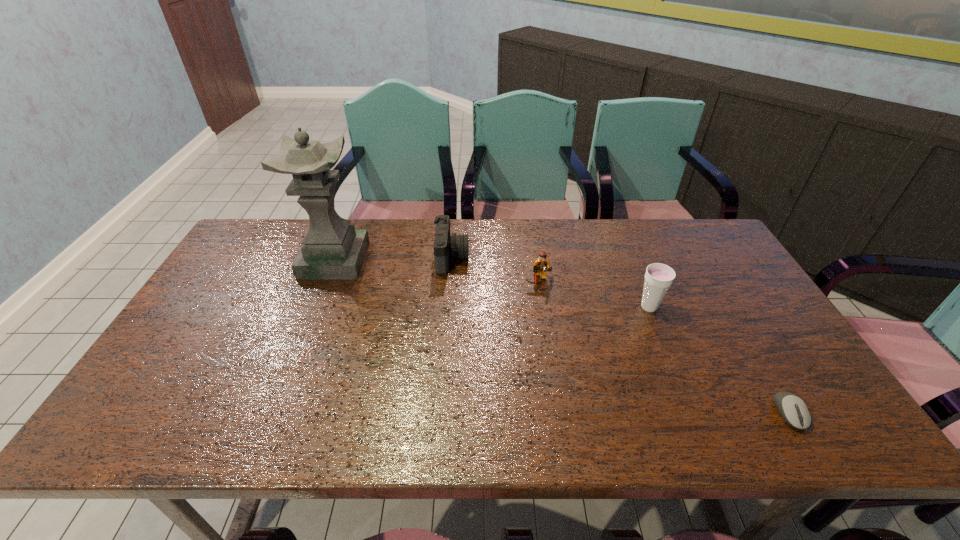
This screenshot has height=540, width=960. Identify the location of vacant space that is in between the nearest object and the camera. (620, 335).

Where is `vacant space that is in between the second object from left to right and the Lego`? vacant space that is in between the second object from left to right and the Lego is located at coordinates (495, 269).

I want to click on empty space that is in between the computer equipment and the second nearest object, so click(x=719, y=360).

Where is `object that ranks as the third closest to the cup`? The image size is (960, 540). object that ranks as the third closest to the cup is located at coordinates (445, 246).

Locate which object ranks second in proximity to the tallest object. Please provide its 2D coordinates. Your answer should be formatted as a tuple, i.e. [(x, y)], where the tuple contains the x and y coordinates of a point satisfying the conditions above.

[(541, 264)]

Where is `free space that satisfies the following two spatial constraints: 1. at the front opening of the tallest object; 2. on the back side of the cup`? The width and height of the screenshot is (960, 540). free space that satisfies the following two spatial constraints: 1. at the front opening of the tallest object; 2. on the back side of the cup is located at coordinates (316, 307).

What are the coordinates of `free space that satisfies the following two spatial constraints: 1. at the lens of the fourth object from right to left; 2. on the right side of the cup` in the screenshot? It's located at (448, 307).

The height and width of the screenshot is (540, 960). I want to click on free location that satisfies the following two spatial constraints: 1. at the lens of the fourth object from right to left; 2. on the back side of the cup, so click(448, 307).

The height and width of the screenshot is (540, 960). Find the location of `free location that satisfies the following two spatial constraints: 1. at the front opening of the cup; 2. on the left side of the tallest object`. free location that satisfies the following two spatial constraints: 1. at the front opening of the cup; 2. on the left side of the tallest object is located at coordinates (316, 307).